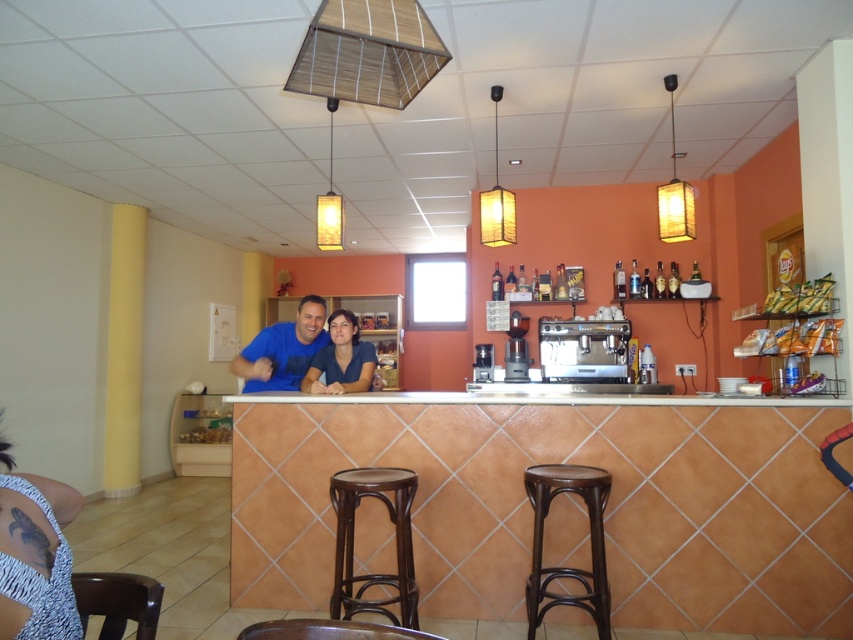
Can you confirm if blue textured dress at lower left is positioned to the right of brown wood stool at center?

In fact, blue textured dress at lower left is to the left of brown wood stool at center.

Can you confirm if blue textured dress at lower left is smaller than brown wood stool at center?

Yes.

At what (x,y) coordinates should I click in order to perform the action: click on blue textured dress at lower left. Please return your answer as a coordinate pair (x, y). Image resolution: width=853 pixels, height=640 pixels. Looking at the image, I should click on (35, 557).

You are a GUI agent. You are given a task and a screenshot of the screen. Output one action in this format:
    pyautogui.click(x=<x>, y=<y>)
    Task: Click on the blue textured dress at lower left
    The height and width of the screenshot is (640, 853).
    Given the screenshot: What is the action you would take?
    pyautogui.click(x=35, y=557)

Measure the distance between brown wood stool at center and brown wood bar stool at lower right.

brown wood stool at center and brown wood bar stool at lower right are 63.17 centimeters apart from each other.

Is brown wood stool at center smaller than brown wood bar stool at lower right?

No.

Who is more forward, (x=405, y=616) or (x=604, y=588)?

Positioned in front is point (x=405, y=616).

I want to click on brown wood stool at center, so click(352, 541).

Does blue textured dress at lower left have a lesser width compared to matte blue shirt at center?

Yes, blue textured dress at lower left is thinner than matte blue shirt at center.

Is blue textured dress at lower left wider than matte blue shirt at center?

In fact, blue textured dress at lower left might be narrower than matte blue shirt at center.

Describe the element at coordinates (35, 557) in the screenshot. I see `blue textured dress at lower left` at that location.

Image resolution: width=853 pixels, height=640 pixels. I want to click on blue textured dress at lower left, so click(x=35, y=557).